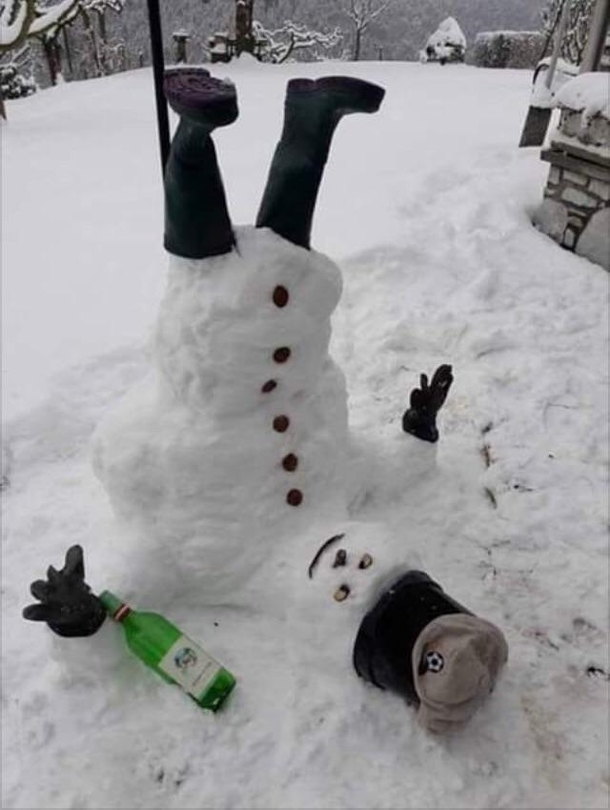
This screenshot has width=610, height=810. Identify the location of alcohol bottle. (159, 631).